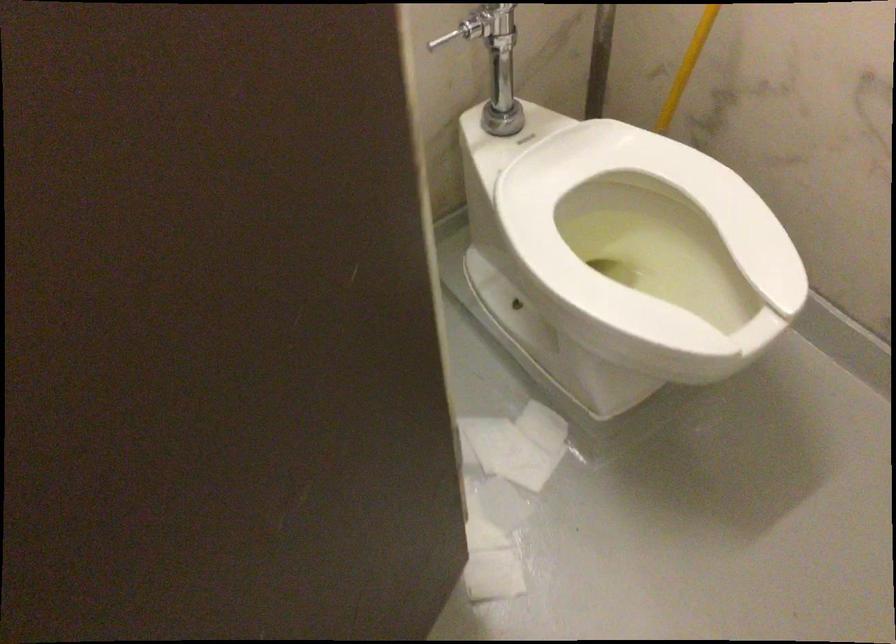
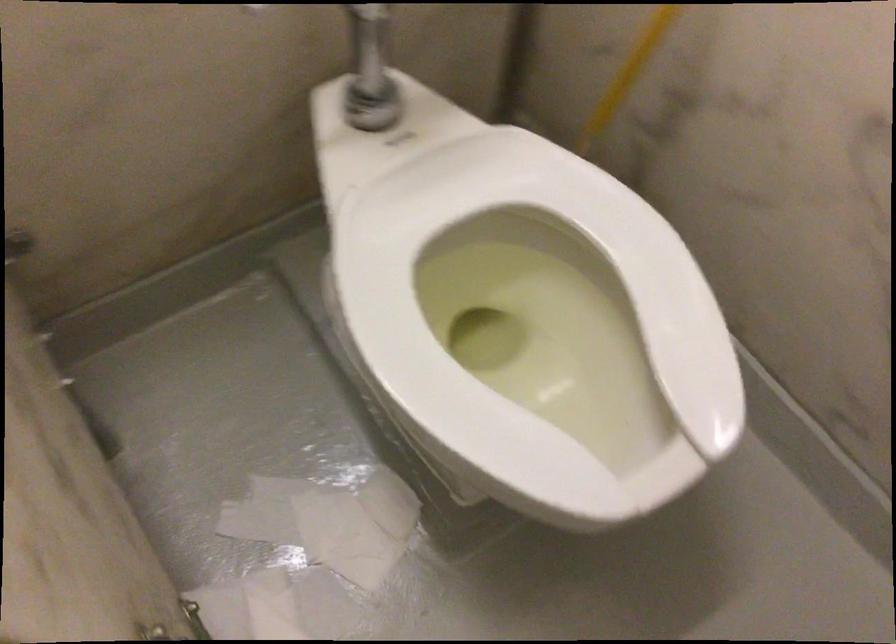
Find the pixel in the second image that matches the point at 630,213 in the first image.

(536, 254)